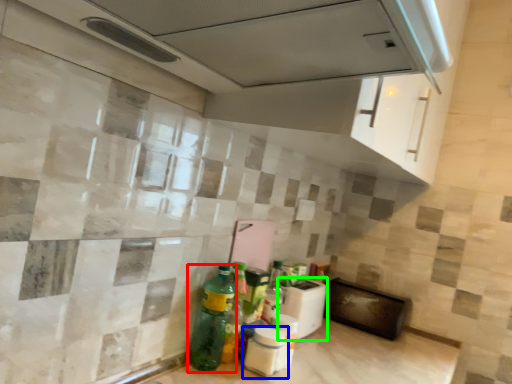
Question: Which object is the farthest from bottle (highlighted by a red box)? Choose among these: bottle (highlighted by a blue box) or appliance (highlighted by a green box).

Choices:
 (A) bottle
 (B) appliance

Answer: (B)